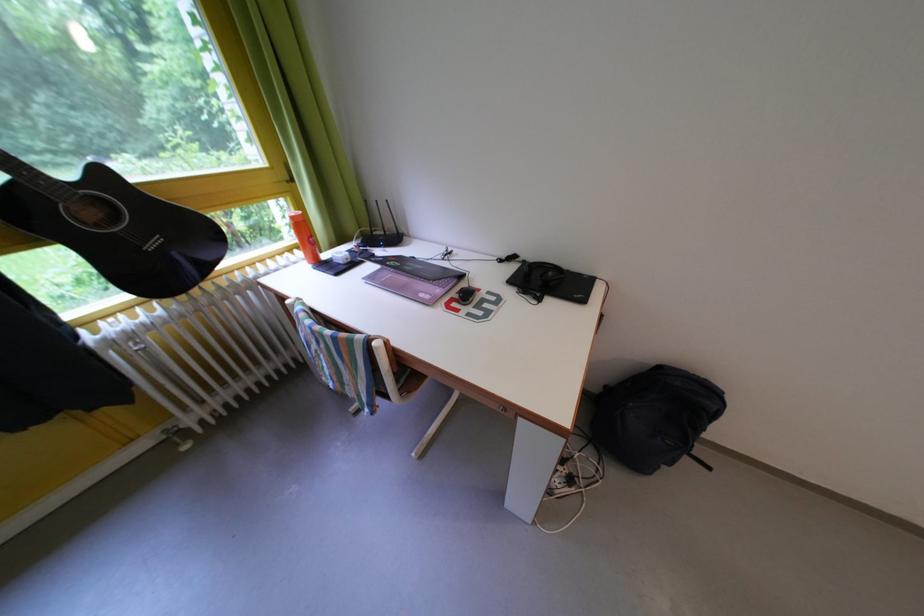
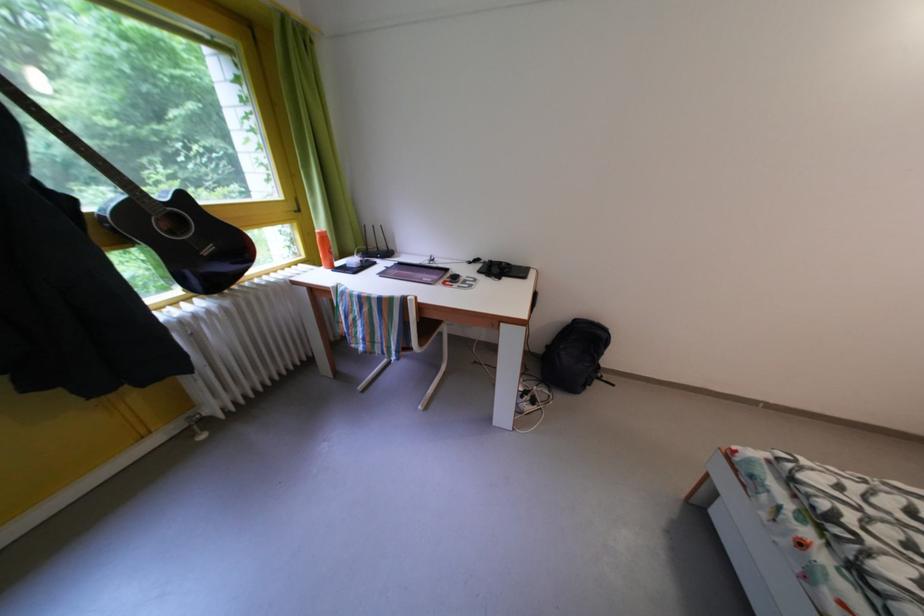
Find the pixel in the second image that matches (616,392) in the first image.

(556, 353)